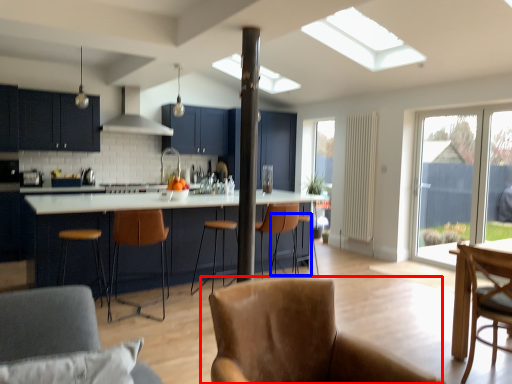
Question: Which object is further to the camera taking this photo, chair (highlighted by a red box) or bar stool (highlighted by a blue box)?

Choices:
 (A) chair
 (B) bar stool

Answer: (B)